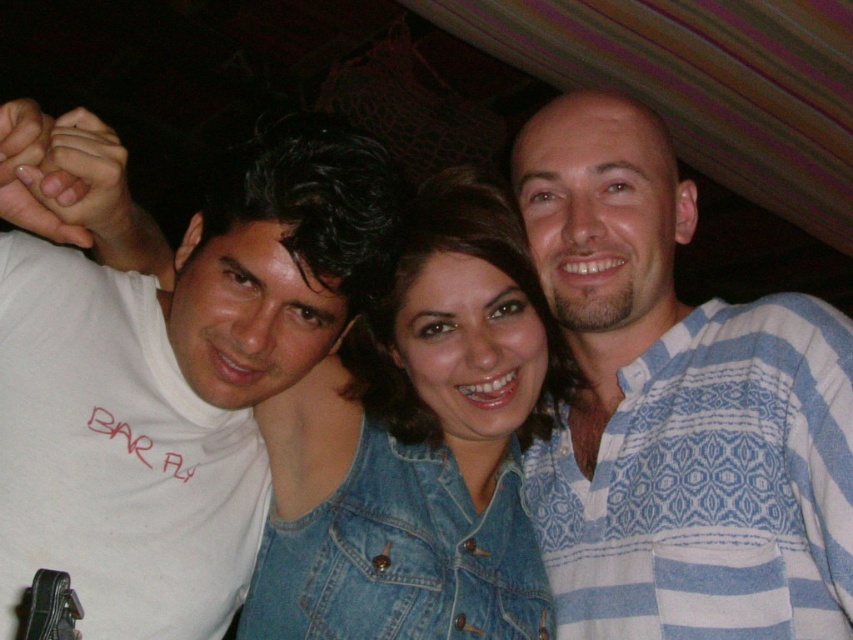
Is point (625, 637) positioned behind point (318, 369)?

No.

The width and height of the screenshot is (853, 640). Describe the element at coordinates (677, 410) in the screenshot. I see `blue striped shirt at right` at that location.

This screenshot has width=853, height=640. In order to click on blue striped shirt at right in this screenshot , I will do `click(677, 410)`.

How distant is blue striped shirt at right from white matte t-shirt at left?

blue striped shirt at right is 14.53 inches from white matte t-shirt at left.

Is blue striped shirt at right behind white matte t-shirt at left?

Yes, it is behind white matte t-shirt at left.

This screenshot has height=640, width=853. Find the location of `blue striped shirt at right`. blue striped shirt at right is located at coordinates (677, 410).

Which is above, white matte t-shirt at left or denim jacket at center?

white matte t-shirt at left is higher up.

Is white matte t-shirt at left wider than denim jacket at center?

Incorrect, white matte t-shirt at left's width does not surpass denim jacket at center's.

Find the location of a particular element. The width and height of the screenshot is (853, 640). white matte t-shirt at left is located at coordinates (178, 381).